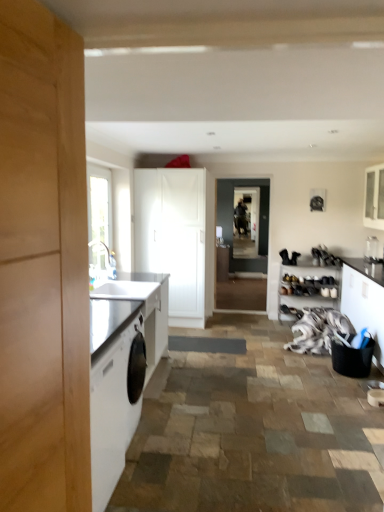
This screenshot has height=512, width=384. What do you see at coordinates (99, 214) in the screenshot? I see `clear glass window at left` at bounding box center [99, 214].

Find the location of a particular element. clear glass window at left is located at coordinates (99, 214).

This screenshot has width=384, height=512. Describe the element at coordinates (305, 276) in the screenshot. I see `white matte shoe rack at right, marked as the third cabinetry in a right-to-left arrangement` at that location.

The image size is (384, 512). What do you see at coordinates (230, 206) in the screenshot?
I see `dark gray matte screen door at center, positioned as the second screen door in back-to-front order` at bounding box center [230, 206].

In order to click on clear glass vase at upper right in this screenshot , I will do `click(371, 248)`.

The image size is (384, 512). I want to click on clear glass window at left, so click(x=99, y=214).

Is clear glass vase at upper right aimed at white matte shoe rack at right, marked as the third cabinetry in a right-to-left arrangement?

No, clear glass vase at upper right is not turned towards white matte shoe rack at right, marked as the third cabinetry in a right-to-left arrangement.

Is clear glass vase at upper right smaller than white matte shoe rack at right, which is the 2th cabinetry in left-to-right order?

Yes.

How many degrees apart are the facing directions of clear glass vase at upper right and white matte shoe rack at right, marked as the third cabinetry in a right-to-left arrangement?

90.3 degrees.

Who is shorter, clear glass vase at upper right or white matte shoe rack at right, marked as the third cabinetry in a right-to-left arrangement?

Standing shorter between the two is clear glass vase at upper right.

Is dark gray matte screen door at center, the second screen door positioned from the right, positioned with its back to clear glass window at left?

No, dark gray matte screen door at center, the second screen door positioned from the right, is not facing the opposite direction of clear glass window at left.

Considering the points (233, 204) and (107, 229), which point is in front, point (233, 204) or point (107, 229)?

The point (107, 229) is closer.

Is dark gray matte screen door at center, the second screen door positioned from the right, inside the boundaries of clear glass window at left, or outside?

The correct answer is: outside.

Looking at the image, does dark gray matte screen door at center, the second screen door positioned from the right, seem bigger or smaller compared to black fabric basket at right, the second cabinetry viewed from the right?

dark gray matte screen door at center, the second screen door positioned from the right, is smaller than black fabric basket at right, the second cabinetry viewed from the right.

Is point (231, 203) behind point (371, 303)?

Yes, it is behind point (371, 303).

Can you confirm if dark gray matte screen door at center, positioned as the second screen door in back-to-front order, is thinner than black fabric basket at right, the third cabinetry viewed from the left?

Yes, dark gray matte screen door at center, positioned as the second screen door in back-to-front order, is thinner than black fabric basket at right, the third cabinetry viewed from the left.

From a real-world perspective, is dark gray matte screen door at center, positioned as the second screen door in back-to-front order, below black fabric basket at right, the second cabinetry viewed from the right?

Incorrect, from a real-world perspective, dark gray matte screen door at center, positioned as the second screen door in back-to-front order, is higher than black fabric basket at right, the second cabinetry viewed from the right.

Which is farther, [308,340] or [224,189]?

Point [224,189]

From the picture: From a real-world perspective, who is located higher, white fabric at lower right or dark gray matte screen door at center, positioned as the second screen door in back-to-front order?

dark gray matte screen door at center, positioned as the second screen door in back-to-front order, from a real-world perspective.

Is white fabric at lower right next to dark gray matte screen door at center, positioned as the second screen door in back-to-front order?

No, white fabric at lower right is not touching dark gray matte screen door at center, positioned as the second screen door in back-to-front order.

From the image's perspective, which object appears higher, white glossy cabinet at upper right, the first cabinetry in the right-to-left sequence, or clear glass vase at upper right?

white glossy cabinet at upper right, the first cabinetry in the right-to-left sequence.

Could you tell me if white glossy cabinet at upper right, the first cabinetry in the right-to-left sequence, is facing clear glass vase at upper right?

No.

Where is `appliance below the white glossy cabinet at upper right, which is the fourth cabinetry from left to right (from a real-world perspective)`? appliance below the white glossy cabinet at upper right, which is the fourth cabinetry from left to right (from a real-world perspective) is located at coordinates (371, 248).

In the scene shown: Which object is closer to the camera, white glossy cabinet at upper right, which is the fourth cabinetry from left to right, or clear glass vase at upper right?

white glossy cabinet at upper right, which is the fourth cabinetry from left to right, is closer to the camera.

Would you say white matte shoe rack at right, marked as the third cabinetry in a right-to-left arrangement, contains white fabric at lower right?

No, white matte shoe rack at right, marked as the third cabinetry in a right-to-left arrangement, does not contain white fabric at lower right.

Between white matte shoe rack at right, marked as the third cabinetry in a right-to-left arrangement, and white fabric at lower right, which one appears on the right side from the viewer's perspective?

Positioned to the right is white matte shoe rack at right, marked as the third cabinetry in a right-to-left arrangement.

Considering the positions of objects white matte shoe rack at right, marked as the third cabinetry in a right-to-left arrangement, and white fabric at lower right in the image provided, who is behind, white matte shoe rack at right, marked as the third cabinetry in a right-to-left arrangement, or white fabric at lower right?

white matte shoe rack at right, marked as the third cabinetry in a right-to-left arrangement.

Is white matte shoe rack at right, marked as the third cabinetry in a right-to-left arrangement, positioned far away from white fabric at lower right?

They are positioned close to each other.

Identify the location of cabinetry that is the 3rd object located above the black fabric basket at right, the third cabinetry viewed from the left (from the image's perspective). (374, 197).

Who is taller, black fabric basket at right, the third cabinetry viewed from the left, or white glossy cabinet at upper right, the first cabinetry in the right-to-left sequence?

black fabric basket at right, the third cabinetry viewed from the left.

Does black fabric basket at right, the third cabinetry viewed from the left, have a lesser width compared to white glossy cabinet at upper right, which is the fourth cabinetry from left to right?

In fact, black fabric basket at right, the third cabinetry viewed from the left, might be wider than white glossy cabinet at upper right, which is the fourth cabinetry from left to right.

Looking at the image, does black fabric basket at right, the second cabinetry viewed from the right, seem bigger or smaller compared to white glossy cabinet at upper right, the first cabinetry in the right-to-left sequence?

Considering their sizes, black fabric basket at right, the second cabinetry viewed from the right, takes up more space than white glossy cabinet at upper right, the first cabinetry in the right-to-left sequence.

Identify the location of cabinetry behind the clear glass vase at upper right. This screenshot has width=384, height=512. (305, 276).

In order to click on window on the left of dark gray matte screen door at center, the second screen door positioned from the right in this screenshot , I will do `click(99, 214)`.

When comparing their distances from clear glass screen door at center, arranged as the first screen door when viewed from the right, does white fabric at lower right or clear glass vase at upper right seem closer?

Based on the image, white fabric at lower right appears to be nearer to clear glass screen door at center, arranged as the first screen door when viewed from the right.

Based on their spatial positions, is white glossy cabinet at upper right, which is the fourth cabinetry from left to right, or clear glass window at left further from white matte shoe rack at right, marked as the third cabinetry in a right-to-left arrangement?

clear glass window at left is positioned further to the anchor white matte shoe rack at right, marked as the third cabinetry in a right-to-left arrangement.

Looking at the image, which one is located further to clear glass window at left, clear glass screen door at center, marked as the second screen door in a left-to-right arrangement, or white glossy cabinet at upper right, which is the fourth cabinetry from left to right?

white glossy cabinet at upper right, which is the fourth cabinetry from left to right.

Considering their positions, is white matte shoe rack at right, which is the 2th cabinetry in left-to-right order, positioned further to white matte cabinet at center, which is counted as the 1th cabinetry, starting from the left, than black fabric basket at right, the third cabinetry viewed from the left?

black fabric basket at right, the third cabinetry viewed from the left.

From the picture: From the image, which object appears to be nearer to clear glass window at left, dark gray matte screen door at center, marked as the first screen door in a front-to-back arrangement, or clear glass screen door at center, which ranks as the second screen door in front-to-back order?

The object closer to clear glass window at left is dark gray matte screen door at center, marked as the first screen door in a front-to-back arrangement.

From the image, which object appears to be nearer to white matte cabinet at center, which is counted as the 1th cabinetry, starting from the left, white fabric at lower right or clear glass vase at upper right?

white fabric at lower right lies closer to white matte cabinet at center, which is counted as the 1th cabinetry, starting from the left, than the other object.

Which object lies nearer to the anchor point clear glass screen door at center, which ranks as the second screen door in front-to-back order, white glossy cabinet at upper right, the first cabinetry in the right-to-left sequence, or black fabric basket at right, the third cabinetry viewed from the left?

Based on the image, white glossy cabinet at upper right, the first cabinetry in the right-to-left sequence, appears to be nearer to clear glass screen door at center, which ranks as the second screen door in front-to-back order.

Consider the image. Which object lies nearer to the anchor point white glossy cabinet at upper right, which is the fourth cabinetry from left to right, dark gray matte screen door at center, the 1th screen door when ordered from left to right, or clear glass vase at upper right?

Based on the image, clear glass vase at upper right appears to be nearer to white glossy cabinet at upper right, which is the fourth cabinetry from left to right.

Find the location of a particular element. laundry situated between white matte cabinet at center, the fourth cabinetry positioned from the right, and black fabric basket at right, the second cabinetry viewed from the right, from left to right is located at coordinates (318, 330).

Locate an element on the screen. laundry between black fabric basket at right, the second cabinetry viewed from the right, and white matte shoe rack at right, which is the 2th cabinetry in left-to-right order, from front to back is located at coordinates (318, 330).

Image resolution: width=384 pixels, height=512 pixels. I want to click on cabinetry positioned between white matte cabinet at center, the fourth cabinetry positioned from the right, and clear glass screen door at center, marked as the second screen door in a left-to-right arrangement, from near to far, so (305, 276).

Locate an element on the screen. The image size is (384, 512). laundry positioned between black fabric basket at right, the third cabinetry viewed from the left, and clear glass screen door at center, which ranks as the 1th screen door in back-to-front order, from near to far is located at coordinates (318, 330).